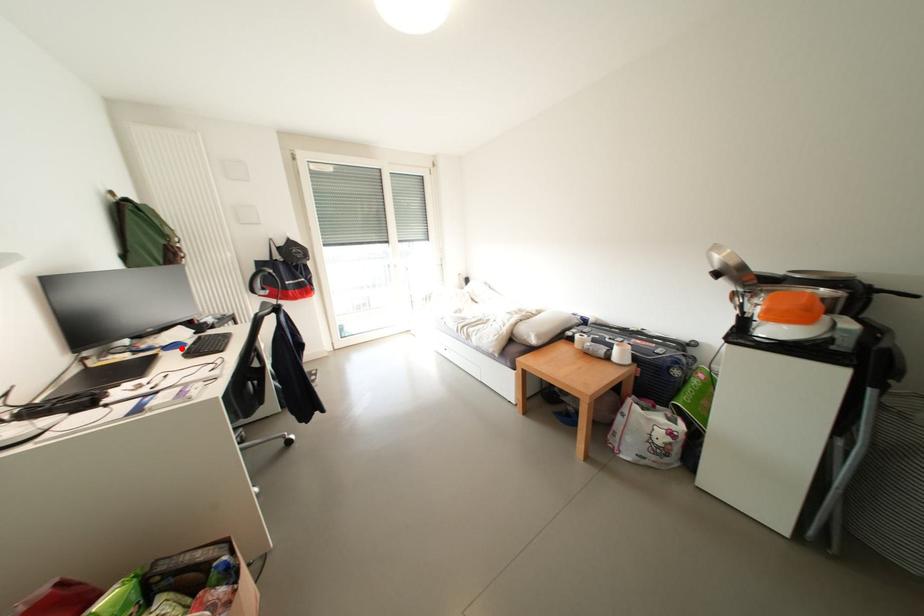
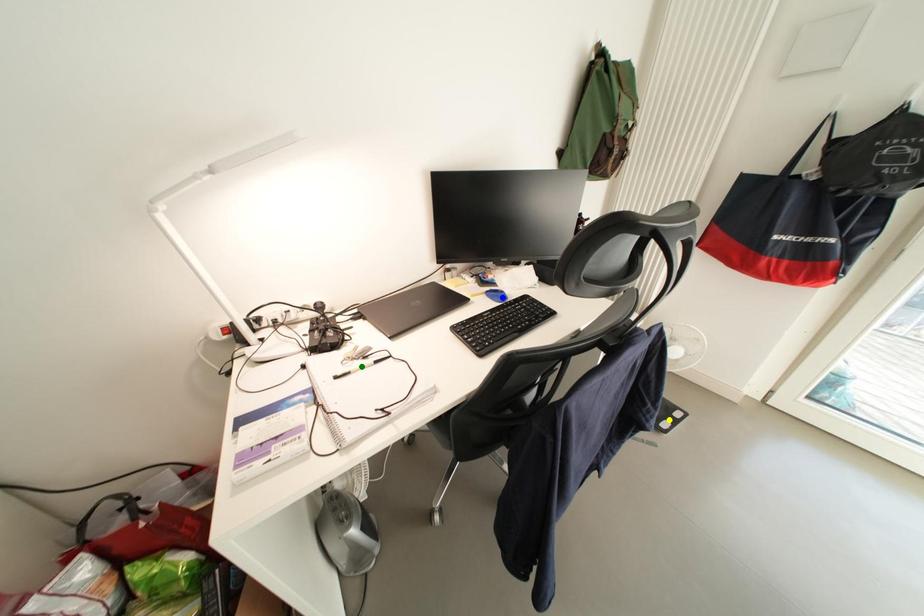
Question: I am providing you with two images of the same scene from different viewpoints. A red point is marked on the first image. You are given multiple points on the second image. Which mark in image 2 goes with the point in image 1?

Choices:
 (A) blue point
 (B) green point
 (C) yellow point

Answer: (A)